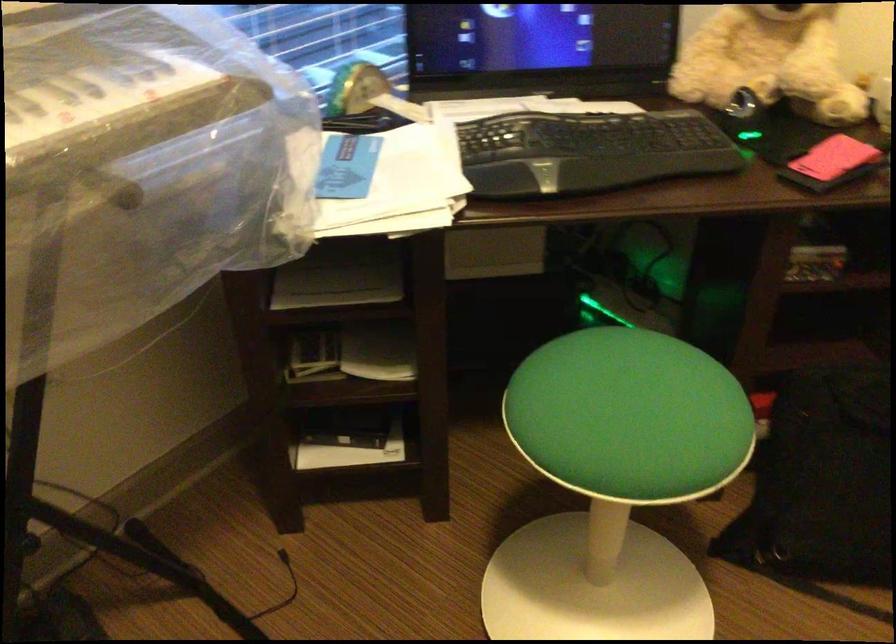
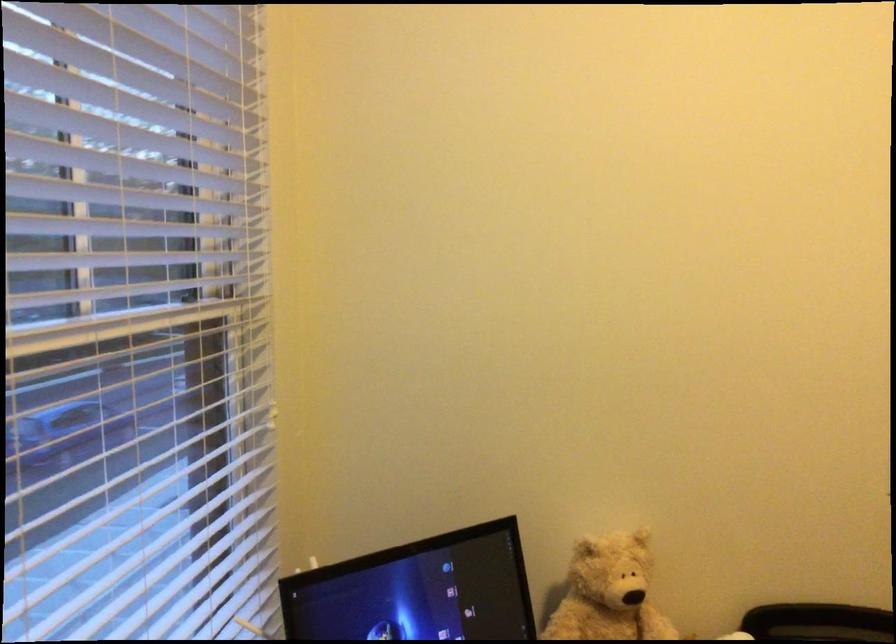
Based on the continuous images, in which direction is the camera rotating?

The rotation direction of the camera is right-up.